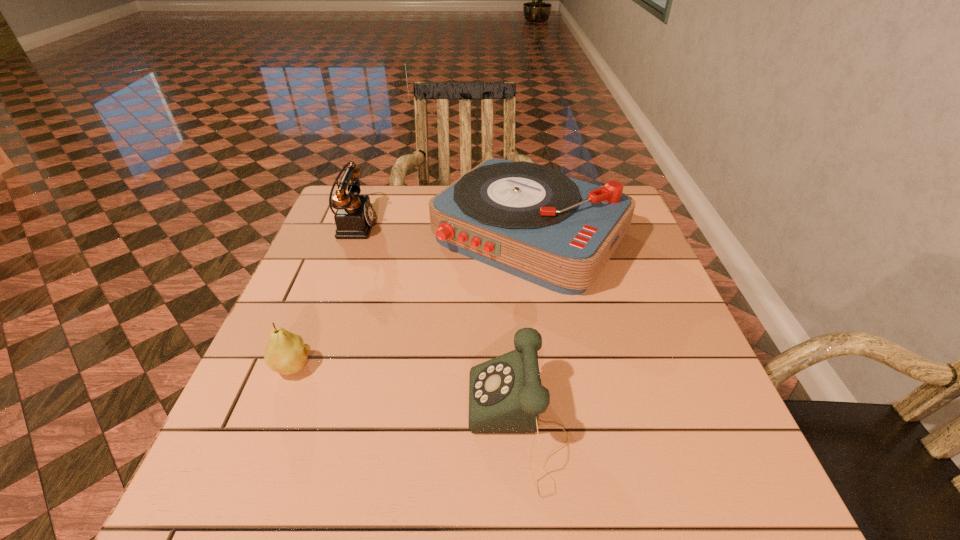
At what (x,y) coordinates should I click in order to perform the action: click on vacant region at the far edge. Please return your answer as a coordinate pair (x, y). This screenshot has height=540, width=960. Looking at the image, I should click on (413, 198).

This screenshot has width=960, height=540. I want to click on vacant space at the near edge of the desktop, so click(301, 497).

Locate an element on the screen. vacant area at the left edge of the desktop is located at coordinates (365, 254).

In the image, there is a desktop. Where is `vacant space at the right edge`? vacant space at the right edge is located at coordinates (619, 289).

The height and width of the screenshot is (540, 960). I want to click on vacant area that lies between the left telephone and the pear, so click(323, 296).

Image resolution: width=960 pixels, height=540 pixels. I want to click on free space between the taller telephone and the shorter telephone, so click(x=435, y=325).

The height and width of the screenshot is (540, 960). I want to click on unoccupied area between the nearer telephone and the left telephone, so click(435, 325).

Identify the location of vacant area between the pear and the record player. The image size is (960, 540). (411, 301).

Find the location of a particular element. This screenshot has width=960, height=540. empty location between the taller telephone and the shorter telephone is located at coordinates (435, 325).

Where is `vacant area that lies between the right telephone and the farther telephone`? The width and height of the screenshot is (960, 540). vacant area that lies between the right telephone and the farther telephone is located at coordinates (435, 325).